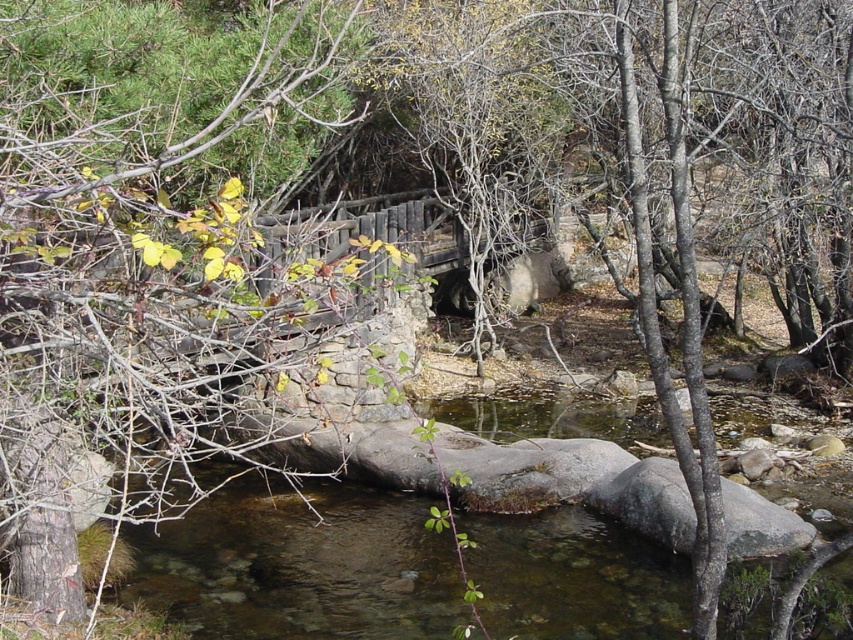
You are standing on the rustic wooden bridge and looking towards the green leafy branches at upper left and the clear water at center. Which object is nearer to you?

The green leafy branches at upper left are closer to you than the clear water at center.

You are standing at the center of the rustic wooden bridge and looking towards the upper left. What do you see at the point marked by coordinates point (135, 291)?

At the point marked by coordinates point (135, 291), you see green leafy branches at upper left.

You are an artist planning to paint the scene. You want to ensure the green leafy branches at upper left and the clear water at center are proportionally accurate. Which object should you make larger in your painting?

The green leafy branches at upper left should be made larger than the clear water at center in the painting since the description states that the green leafy branches at upper left is bigger than clear water at center.